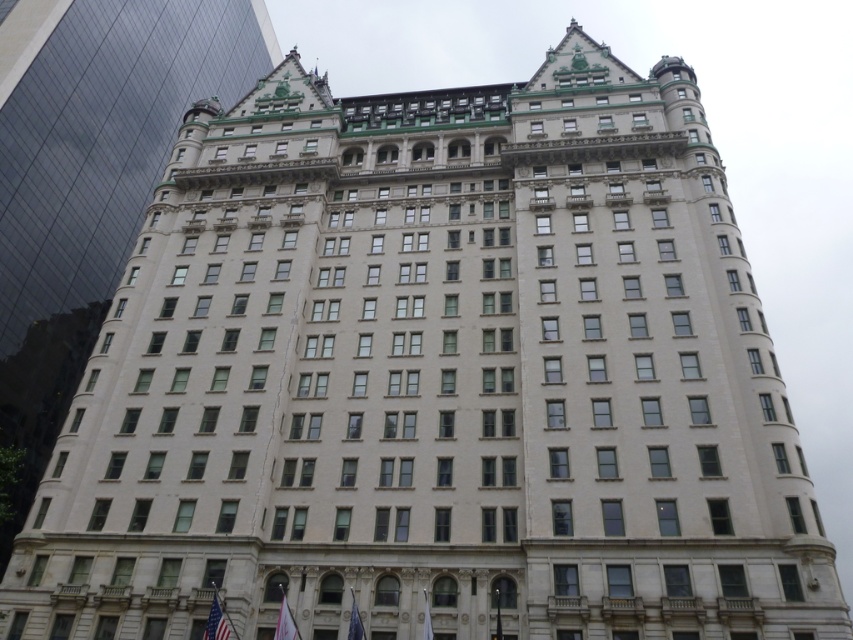
Question: Which of the following is the closest to the observer?

Choices:
 (A) (285, 604)
 (B) (347, 627)

Answer: (A)

Question: Among these points, which one is nearest to the camera?

Choices:
 (A) (430, 634)
 (B) (216, 595)
 (C) (283, 614)

Answer: (A)

Question: Does american flag at lower left appear on the right side of white fabric flag at center?

Choices:
 (A) yes
 (B) no

Answer: (B)

Question: Does white fabric flag at lower center appear on the right side of blue fabric flag at lower center?

Choices:
 (A) no
 (B) yes

Answer: (A)

Question: Based on their relative distances, which object is farther from the white fabric flag at lower center?

Choices:
 (A) american flag at lower left
 (B) blue fabric flag at lower center
 (C) white fabric flag at center

Answer: (C)

Question: Can you confirm if blue fabric flag at lower center is positioned to the right of white fabric flag at center?

Choices:
 (A) yes
 (B) no

Answer: (B)